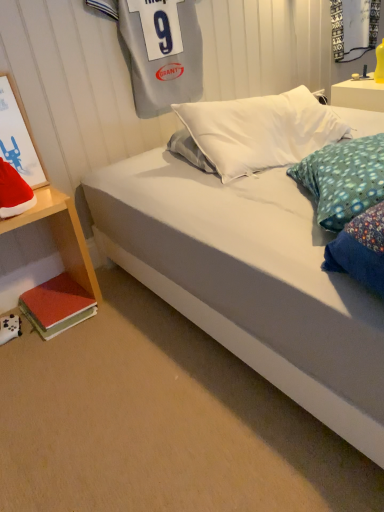
Question: Does transparent glass shop window at upper right come behind matte white picture frame at left?

Choices:
 (A) no
 (B) yes

Answer: (B)

Question: Is transparent glass shop window at upper right thinner than matte white picture frame at left?

Choices:
 (A) yes
 (B) no

Answer: (A)

Question: Is transparent glass shop window at upper right oriented away from matte white picture frame at left?

Choices:
 (A) yes
 (B) no

Answer: (B)

Question: From a real-world perspective, is transparent glass shop window at upper right physically above matte white picture frame at left?

Choices:
 (A) no
 (B) yes

Answer: (B)

Question: Is transparent glass shop window at upper right bigger than matte white picture frame at left?

Choices:
 (A) yes
 (B) no

Answer: (A)

Question: Based on their positions, is white fabric bed at lower left located to the left or right of wooden nightstand at lower left, acting as the 2th nightstand starting from the right?

Choices:
 (A) left
 (B) right

Answer: (B)

Question: Looking at the image, does white fabric bed at lower left seem bigger or smaller compared to wooden nightstand at lower left, acting as the 2th nightstand starting from the right?

Choices:
 (A) small
 (B) big

Answer: (B)

Question: From a real-world perspective, is white fabric bed at lower left above or below wooden nightstand at lower left, which is counted as the second nightstand, starting from the top?

Choices:
 (A) above
 (B) below

Answer: (B)

Question: Which is correct: white fabric bed at lower left is inside wooden nightstand at lower left, the second nightstand from the back, or outside of it?

Choices:
 (A) inside
 (B) outside

Answer: (B)

Question: Is red velvet santa hat at left bigger or smaller than matte white picture frame at left?

Choices:
 (A) big
 (B) small

Answer: (B)

Question: Relative to matte white picture frame at left, is red velvet santa hat at left in front or behind?

Choices:
 (A) behind
 (B) front

Answer: (B)

Question: Is red velvet santa hat at left wider or thinner than matte white picture frame at left?

Choices:
 (A) wide
 (B) thin

Answer: (A)

Question: Considering the positions of point (14, 195) and point (44, 175), is point (14, 195) closer or farther from the camera than point (44, 175)?

Choices:
 (A) closer
 (B) farther

Answer: (A)

Question: Considering their positions, is red velvet santa hat at left located in front of or behind white glossy nightstand at upper right, positioned as the 1th nightstand in right-to-left order?

Choices:
 (A) behind
 (B) front

Answer: (B)

Question: Considering the positions of point (14, 212) and point (377, 96), is point (14, 212) closer or farther from the camera than point (377, 96)?

Choices:
 (A) farther
 (B) closer

Answer: (B)